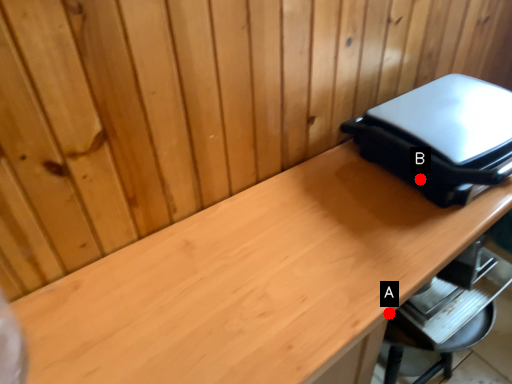
Question: Two points are circled on the image, labeled by A and B beside each circle. Which of the following is the farthest from the observer?

Choices:
 (A) A is further
 (B) B is further

Answer: (B)